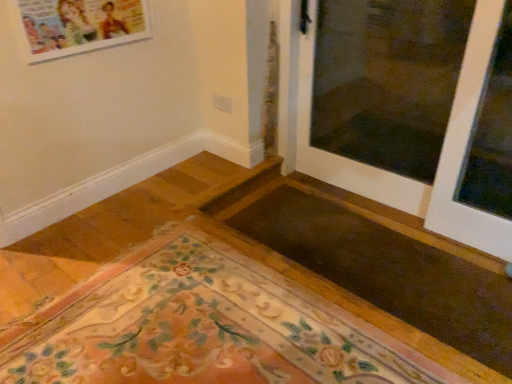
Question: Is white glossy door at upper right positioned with its back to transparent glass window at right?

Choices:
 (A) yes
 (B) no

Answer: (A)

Question: Considering the relative sizes of white glossy door at upper right and transparent glass window at right in the image provided, is white glossy door at upper right thinner than transparent glass window at right?

Choices:
 (A) yes
 (B) no

Answer: (B)

Question: Is the depth of white glossy door at upper right less than that of transparent glass window at right?

Choices:
 (A) yes
 (B) no

Answer: (A)

Question: Does white glossy door at upper right have a larger size compared to transparent glass window at right?

Choices:
 (A) yes
 (B) no

Answer: (A)

Question: Considering the relative sizes of white glossy door at upper right and transparent glass window at right in the image provided, is white glossy door at upper right shorter than transparent glass window at right?

Choices:
 (A) no
 (B) yes

Answer: (B)

Question: Is point (498, 215) closer or farther from the camera than point (317, 157)?

Choices:
 (A) closer
 (B) farther

Answer: (A)

Question: Looking at the image, does transparent glass window at right seem bigger or smaller compared to white glossy door at upper right?

Choices:
 (A) big
 (B) small

Answer: (B)

Question: In terms of height, does transparent glass window at right look taller or shorter compared to white glossy door at upper right?

Choices:
 (A) tall
 (B) short

Answer: (A)

Question: Is transparent glass window at right in front of or behind white glossy door at upper right in the image?

Choices:
 (A) behind
 (B) front

Answer: (A)

Question: From their relative heights in the image, would you say white glossy door at upper right is taller or shorter than floral carpet at lower left?

Choices:
 (A) tall
 (B) short

Answer: (A)

Question: From a real-world perspective, relative to floral carpet at lower left, is white glossy door at upper right vertically above or below?

Choices:
 (A) below
 (B) above

Answer: (B)

Question: Do you think white glossy door at upper right is within floral carpet at lower left, or outside of it?

Choices:
 (A) inside
 (B) outside

Answer: (B)

Question: From the image's perspective, is white glossy door at upper right located above or below floral carpet at lower left?

Choices:
 (A) above
 (B) below

Answer: (A)

Question: From a real-world perspective, relative to floral carpet at lower left, is transparent glass window at right vertically above or below?

Choices:
 (A) below
 (B) above

Answer: (B)

Question: Is transparent glass window at right spatially inside floral carpet at lower left, or outside of it?

Choices:
 (A) outside
 (B) inside

Answer: (A)